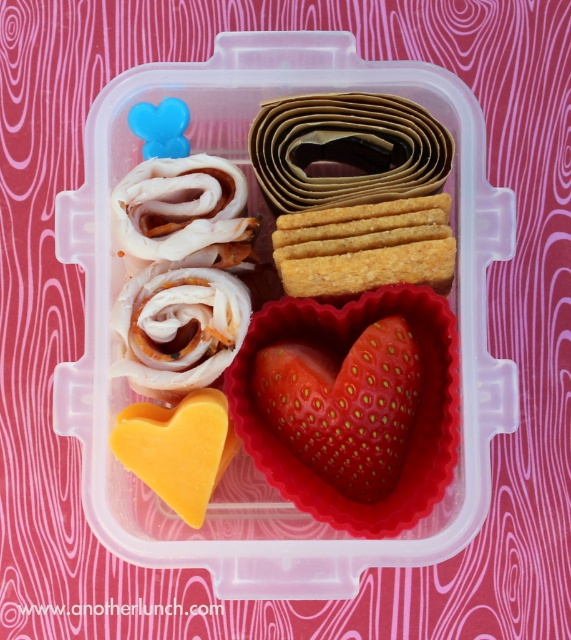
Measure the distance between red matte strawberry at center and golden crisp crackers at center.

red matte strawberry at center is 4.98 inches from golden crisp crackers at center.

Is red matte strawberry at center thinner than golden crisp crackers at center?

Correct, red matte strawberry at center's width is less than golden crisp crackers at center's.

Is point (384, 381) in front of point (295, 246)?

Yes, it is.

The height and width of the screenshot is (640, 571). I want to click on red matte strawberry at center, so click(343, 404).